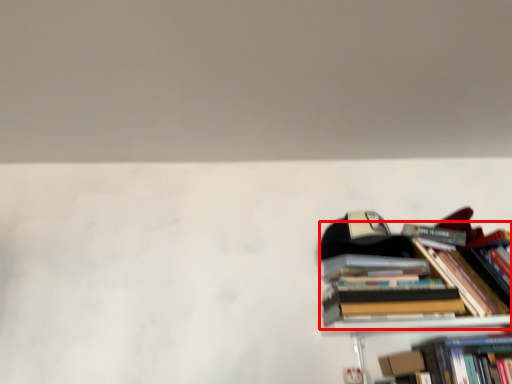
Question: Considering the relative positions of book (annotated by the red box) and paperback book in the image provided, where is book (annotated by the red box) located with respect to the staircase?

Choices:
 (A) left
 (B) right

Answer: (B)